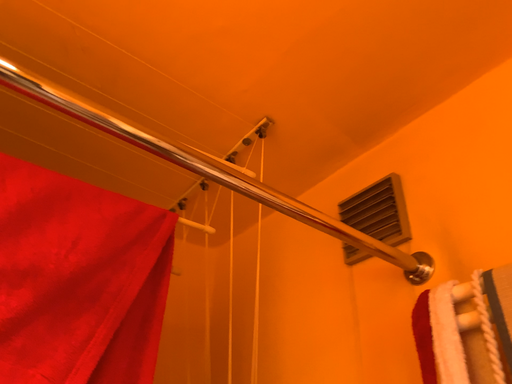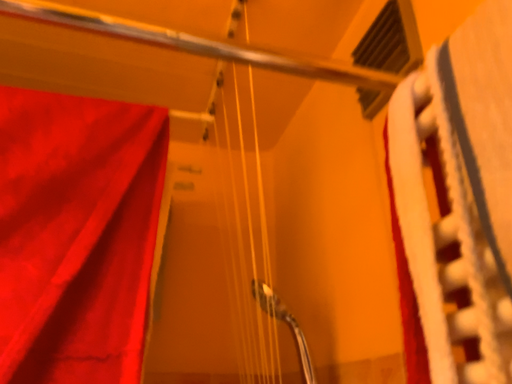
Question: Which way did the camera rotate in the video?

Choices:
 (A) rotated upward
 (B) rotated downward

Answer: (B)